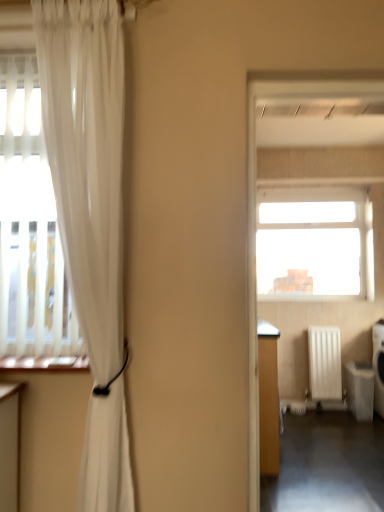
Question: Does white plastic dishwasher at lower right touch translucent white curtain at left?

Choices:
 (A) yes
 (B) no

Answer: (B)

Question: Is white plastic dishwasher at lower right looking in the opposite direction of translucent white curtain at left?

Choices:
 (A) no
 (B) yes

Answer: (A)

Question: Is white plastic dishwasher at lower right not inside translucent white curtain at left?

Choices:
 (A) yes
 (B) no

Answer: (A)

Question: Is white plastic dishwasher at lower right far from translucent white curtain at left?

Choices:
 (A) yes
 (B) no

Answer: (A)

Question: Can you confirm if white plastic dishwasher at lower right is taller than translucent white curtain at left?

Choices:
 (A) yes
 (B) no

Answer: (B)

Question: Considering the relative sizes of white plastic dishwasher at lower right and translucent white curtain at left in the image provided, is white plastic dishwasher at lower right wider than translucent white curtain at left?

Choices:
 (A) no
 (B) yes

Answer: (B)

Question: Considering the relative positions of white plastic dishwasher at lower right and transparent glass window at upper center in the image provided, is white plastic dishwasher at lower right in front of transparent glass window at upper center?

Choices:
 (A) yes
 (B) no

Answer: (A)

Question: Considering the relative sizes of white plastic dishwasher at lower right and transparent glass window at upper center in the image provided, is white plastic dishwasher at lower right bigger than transparent glass window at upper center?

Choices:
 (A) no
 (B) yes

Answer: (A)

Question: From the image's perspective, is white plastic dishwasher at lower right located above transparent glass window at upper center?

Choices:
 (A) no
 (B) yes

Answer: (A)

Question: From a real-world perspective, is white plastic dishwasher at lower right located beneath transparent glass window at upper center?

Choices:
 (A) yes
 (B) no

Answer: (A)

Question: Is white plastic dishwasher at lower right taller than transparent glass window at upper center?

Choices:
 (A) no
 (B) yes

Answer: (A)

Question: Considering the relative positions of white plastic dishwasher at lower right and transparent glass window at upper center in the image provided, is white plastic dishwasher at lower right behind transparent glass window at upper center?

Choices:
 (A) no
 (B) yes

Answer: (A)

Question: Is dark gray concrete corridor at lower right not close to white matte radiator at right?

Choices:
 (A) no
 (B) yes

Answer: (A)